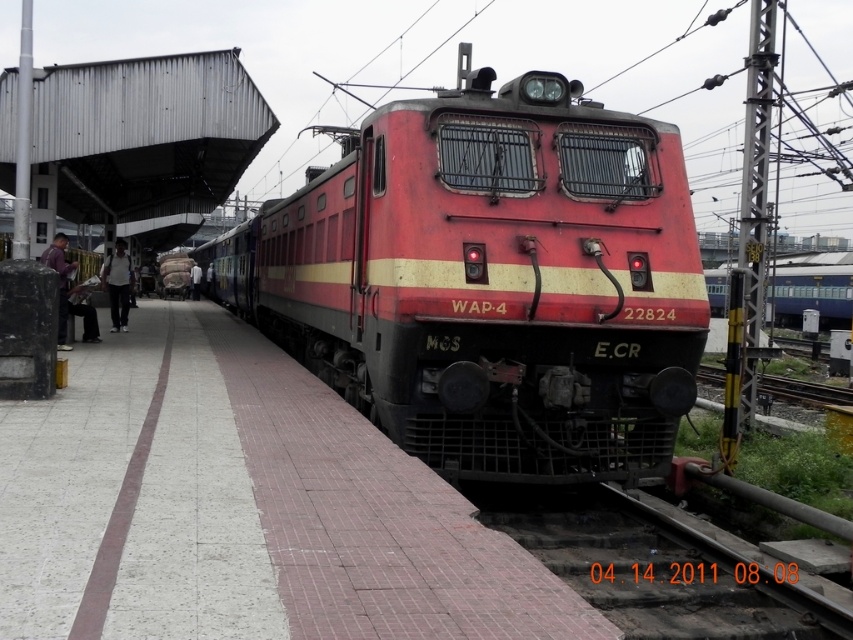
Is metallic blue train at right below light gray fabric shirt at left?

Yes, metallic blue train at right is below light gray fabric shirt at left.

Which is more to the right, metallic blue train at right or light gray fabric shirt at left?

From the viewer's perspective, metallic blue train at right appears more on the right side.

Image resolution: width=853 pixels, height=640 pixels. What do you see at coordinates (811, 292) in the screenshot? I see `metallic blue train at right` at bounding box center [811, 292].

Where is `metallic blue train at right`? The width and height of the screenshot is (853, 640). metallic blue train at right is located at coordinates (811, 292).

Does purple fabric bag at left come in front of white clothed person at center?

That is True.

Which is in front, point (59, 316) or point (198, 291)?

Point (59, 316)

Locate an element on the screen. This screenshot has width=853, height=640. purple fabric bag at left is located at coordinates (61, 282).

Is white concrete platform at center above purple fabric bag at left?

No, white concrete platform at center is not above purple fabric bag at left.

This screenshot has height=640, width=853. Describe the element at coordinates (241, 508) in the screenshot. I see `white concrete platform at center` at that location.

This screenshot has height=640, width=853. I want to click on white concrete platform at center, so click(241, 508).